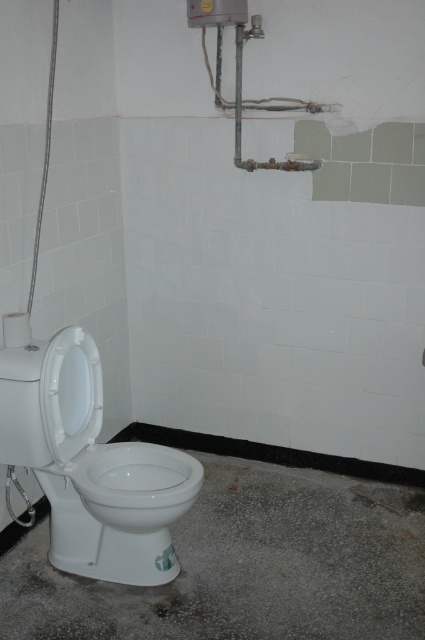
Question: Is gray concrete floor at lower center positioned in front of metallic gray pipes at upper center?

Choices:
 (A) yes
 (B) no

Answer: (A)

Question: Which point appears farthest from the camera in this image?

Choices:
 (A) (42, 600)
 (B) (193, 1)
 (C) (96, 496)

Answer: (B)

Question: Which point appears farthest from the camera in this image?

Choices:
 (A) (124, 449)
 (B) (266, 614)
 (C) (237, 161)

Answer: (C)

Question: Is white glossy toilet bowl at center below metallic gray pipes at upper center?

Choices:
 (A) no
 (B) yes

Answer: (B)

Question: Which object is positioned farthest from the white glossy toilet bowl at center?

Choices:
 (A) metallic gray pipes at upper center
 (B) gray concrete floor at lower center

Answer: (A)

Question: Can you confirm if gray concrete floor at lower center is wider than metallic gray pipes at upper center?

Choices:
 (A) no
 (B) yes

Answer: (B)